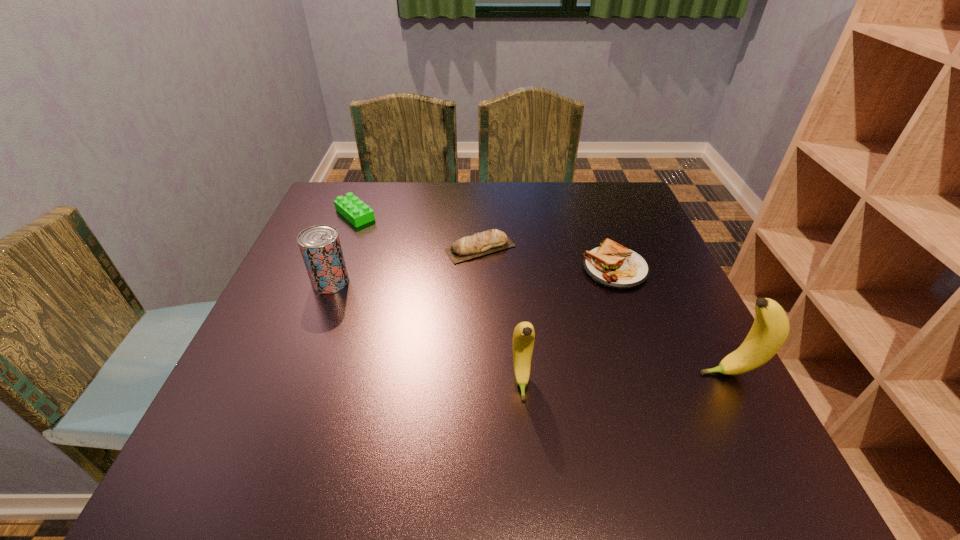
Where is `object that is at the far left corner`? object that is at the far left corner is located at coordinates (350, 207).

The width and height of the screenshot is (960, 540). In order to click on vacant space at the far edge of the desktop in this screenshot , I will do `click(525, 210)`.

The height and width of the screenshot is (540, 960). I want to click on free space at the left edge of the desktop, so click(293, 326).

You are a GUI agent. You are given a task and a screenshot of the screen. Output one action in this format:
    pyautogui.click(x=<x>, y=<y>)
    Task: Click on the free spot at the right edge of the desktop
    
    Given the screenshot: What is the action you would take?
    pyautogui.click(x=721, y=360)

At what (x,y) coordinates should I click in order to perform the action: click on blank space at the far left corner of the desktop. Please return your answer as a coordinate pair (x, y). This screenshot has height=540, width=960. Looking at the image, I should click on (338, 221).

Find the location of `vacant space at the far right corner of the desktop`. vacant space at the far right corner of the desktop is located at coordinates tap(596, 210).

You are a GUI agent. You are given a task and a screenshot of the screen. Output one action in this format:
    pyautogui.click(x=<x>, y=<y>)
    Task: Click on the vacant point located between the third tallest object and the pita bread
    
    Given the screenshot: What is the action you would take?
    pyautogui.click(x=405, y=265)

Where is `free space between the pita bread and the Lego`? free space between the pita bread and the Lego is located at coordinates (418, 231).

You are a GUI agent. You are given a task and a screenshot of the screen. Output one action in this format:
    pyautogui.click(x=<x>, y=<y>)
    Task: Click on the vacant region between the fourth shortest object and the left banana
    The width and height of the screenshot is (960, 540).
    Given the screenshot: What is the action you would take?
    pyautogui.click(x=426, y=332)

This screenshot has width=960, height=540. I want to click on free space between the sandwich and the left banana, so click(568, 325).